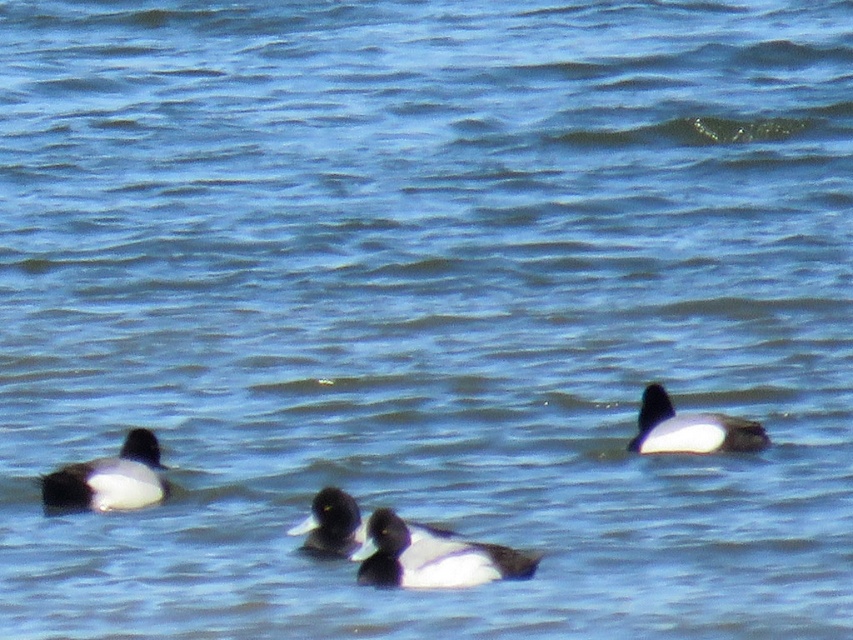
You are observing two ducks in the water. The white matte duck at left and the white matte duck at right. From your perspective, which duck is closer to you?

The white matte duck at left is closer to you because it is in front of the white matte duck at right.

You are a photographer trying to capture the ducks in the water. You want to take a photo where the white matte duck at right and the white matte duck at center are both in focus. Which duck should you focus on first to ensure both are sharp?

You should focus on the white matte duck at center first because it is wider than the white matte duck at right, making it easier to achieve sharp focus on both.

You are observing three ducks swimming on a body of water. You notice a white matte duck at left and a white matte duck at right. Which duck is positioned to the left of the other?

The white matte duck at left is positioned to the left of the white matte duck at right.